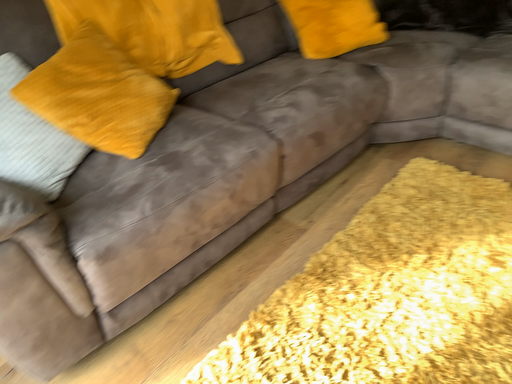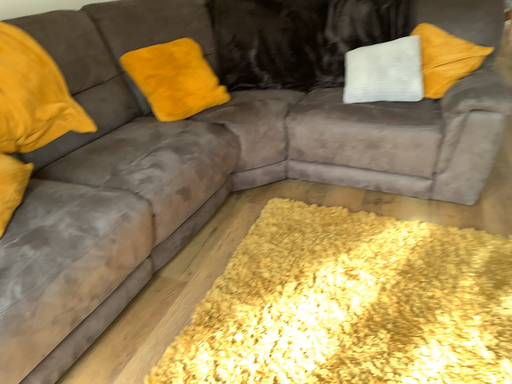
Question: Which way did the camera rotate in the video?

Choices:
 (A) rotated left
 (B) rotated right

Answer: (B)